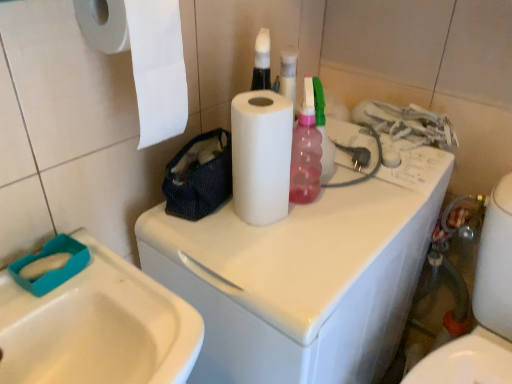
I want to click on free space above white glossy sink at lower left (from a real-world perspective), so (97, 289).